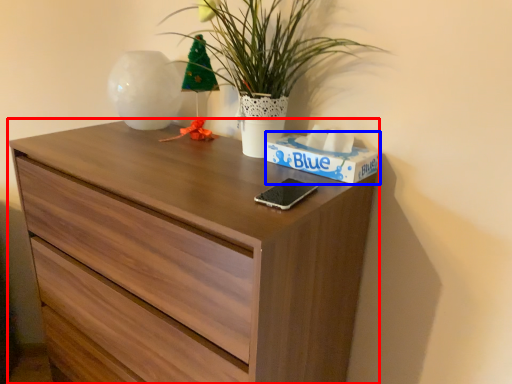
Question: Which point is closer to the camera, chest of drawers (highlighted by a red box) or box (highlighted by a blue box)?

Choices:
 (A) chest of drawers
 (B) box

Answer: (A)